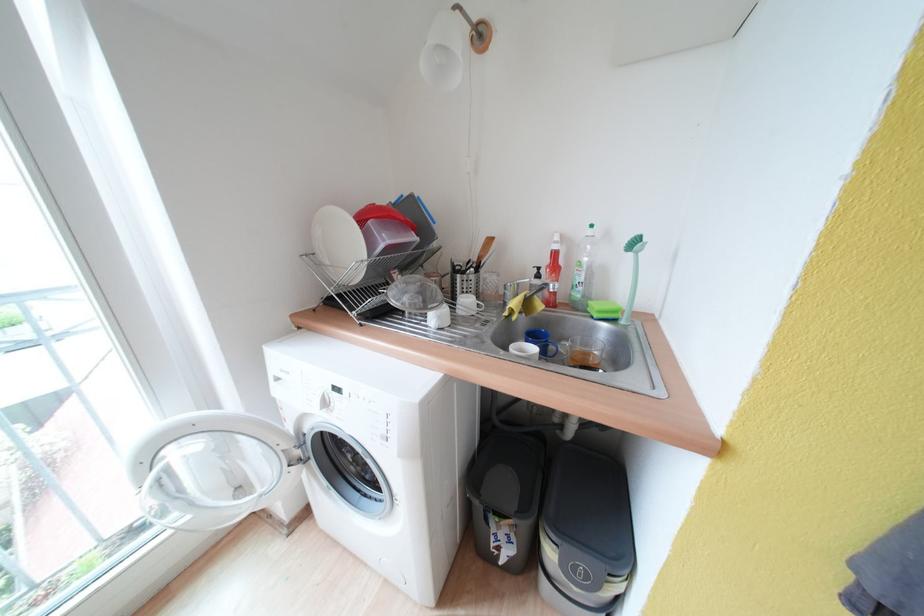
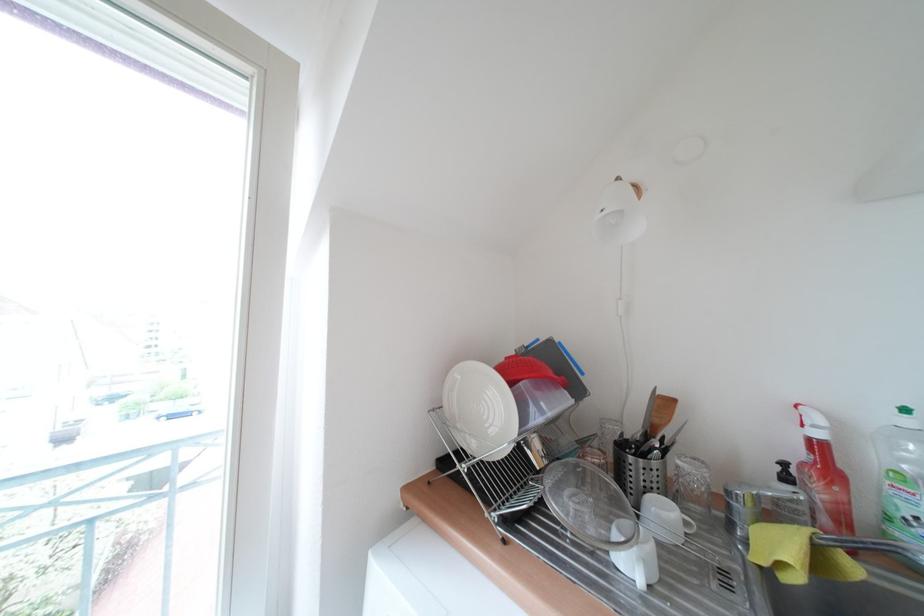
Where in the second image is the point corresponding to (444,321) from the first image?

(651, 567)